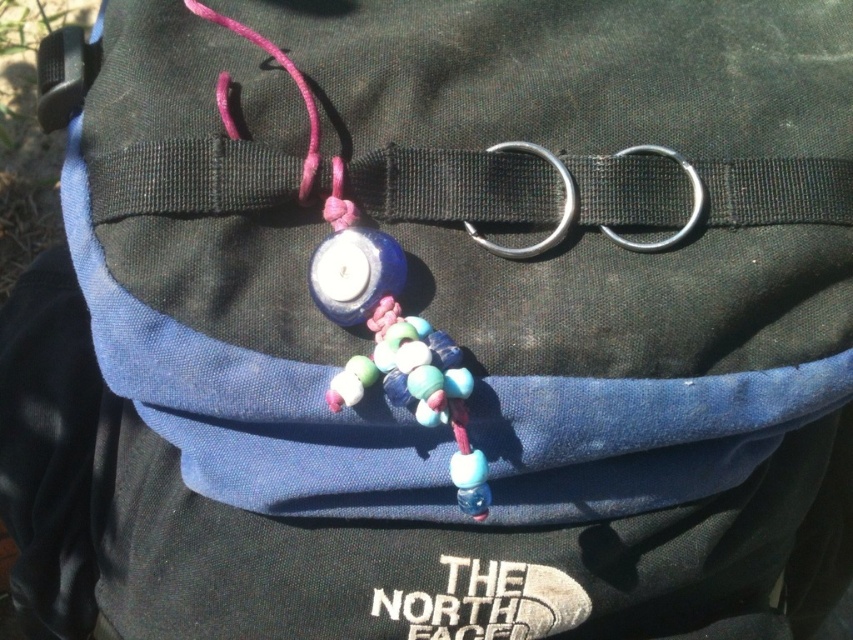
Question: Which point is closer to the camera?

Choices:
 (A) matte blue bead at center
 (B) black fabric strap at center

Answer: (A)

Question: Does black fabric strap at center appear over matte blue bead at center?

Choices:
 (A) yes
 (B) no

Answer: (A)

Question: Can you confirm if black fabric strap at center is thinner than matte blue bead at center?

Choices:
 (A) no
 (B) yes

Answer: (A)

Question: Is black fabric strap at center to the left of matte blue bead at center from the viewer's perspective?

Choices:
 (A) no
 (B) yes

Answer: (A)